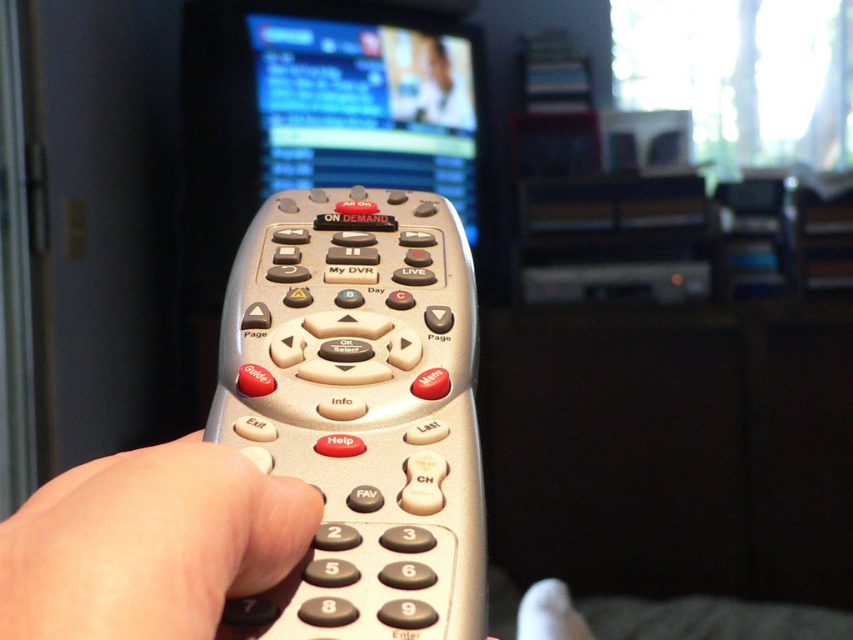
You are trying to use the remote to change the channel. Since the skinny beige hand at center is behind the silver metallic remote at center, can you see the buttons on the remote?

The skinny beige hand at center is behind the silver metallic remote at center, so the hand is not blocking the front of the remote. Therefore, you can see the buttons on the silver metallic remote at center.

You are trying to press a button on the silver metallic remote at center. Since the skinny beige hand at center is holding it, where should you move your hand to access the remote?

The silver metallic remote at center is to the right of the skinny beige hand at center, so you should move your hand to the right of the skinny beige hand at center to access the silver metallic remote at center.